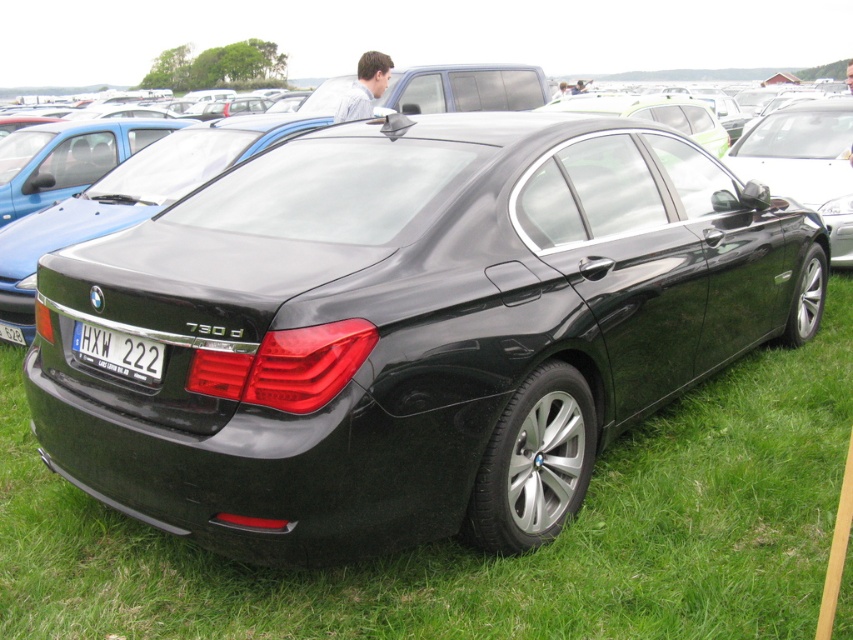
You are standing at a car exhibition and want to take a photo of the BMW 730d sedan. The camera you are using has a focal length of 50mm and a sensor size of 24x36mm. If you want to capture the entire sedan in the frame without cropping, what is the minimum distance you should maintain from the car? The sedan is 5.2 meters long. The point at coordinates point (134, 356) is 9.03 feet away from you.

The point at coordinates point (134, 356) is 9.03 feet away from you, so you should maintain a distance of at least 9.03 feet to ensure the entire sedan fits in the frame.

You are a parking attendant who needs to verify the license plate numbers of two vehicles. You have a camera that can only capture objects up close. Which license plate, the white plastic license plate at center or the white plastic license plate at rear, should you get closer to in order to read the numbers clearly?

The white plastic license plate at center has a larger size compared to the white plastic license plate at rear. Therefore, you can get closer to the white plastic license plate at center to read the numbers clearly without needing to move as close as you would for the smaller rear plate.

From the picture: You are standing in front of the black BMW 730d sedan parked on the grassy area. You see a point labeled as point (480, 552). Where is this point located in relation to the car?

The point (480, 552) corresponds to green grass at lower center, which is located in front of the car.